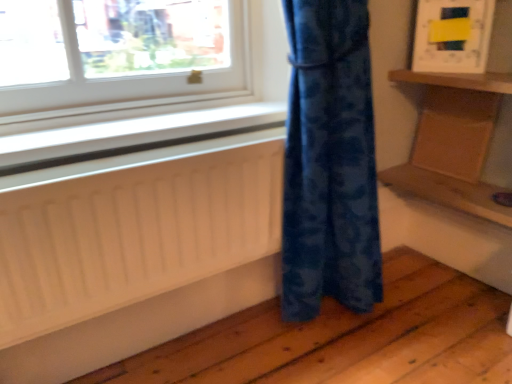
Question: From a real-world perspective, is white matte radiator at lower left above or below wooden at right, the first shelf when ordered from bottom to top?

Choices:
 (A) above
 (B) below

Answer: (A)

Question: Considering the positions of point (243, 178) and point (432, 188), is point (243, 178) closer or farther from the camera than point (432, 188)?

Choices:
 (A) closer
 (B) farther

Answer: (A)

Question: Which object is the farthest from the wooden at right, the second shelf in the top-to-bottom sequence?

Choices:
 (A) wooden shelf at upper right, the second shelf from the bottom
 (B) wooden tray at right
 (C) white plastic window sill at lower left
 (D) white matte radiator at lower left

Answer: (D)

Question: Based on their relative distances, which object is farther from the wooden at right, the first shelf when ordered from bottom to top?

Choices:
 (A) wooden shelf at upper right, acting as the first shelf starting from the top
 (B) white plastic window sill at lower left
 (C) white matte radiator at lower left
 (D) wooden tray at right

Answer: (C)